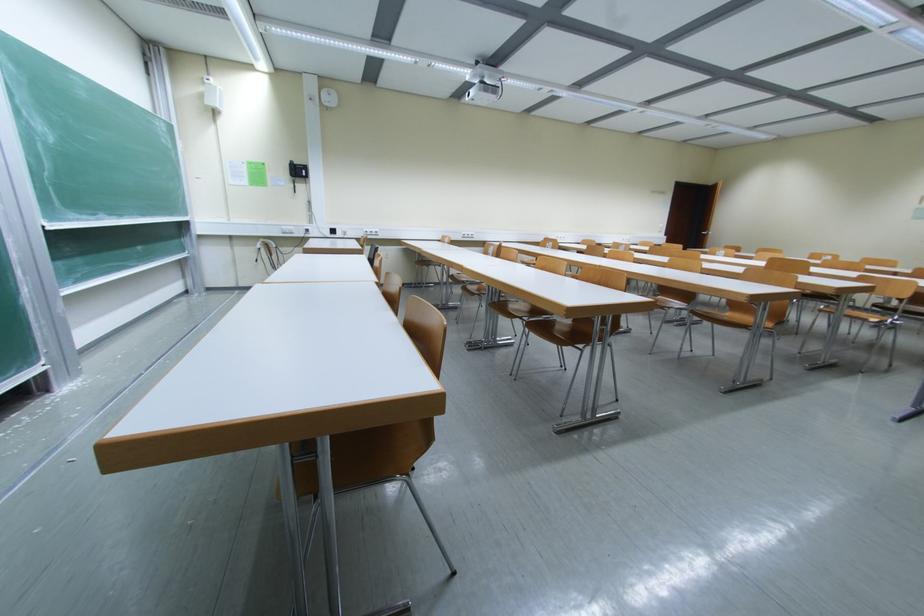
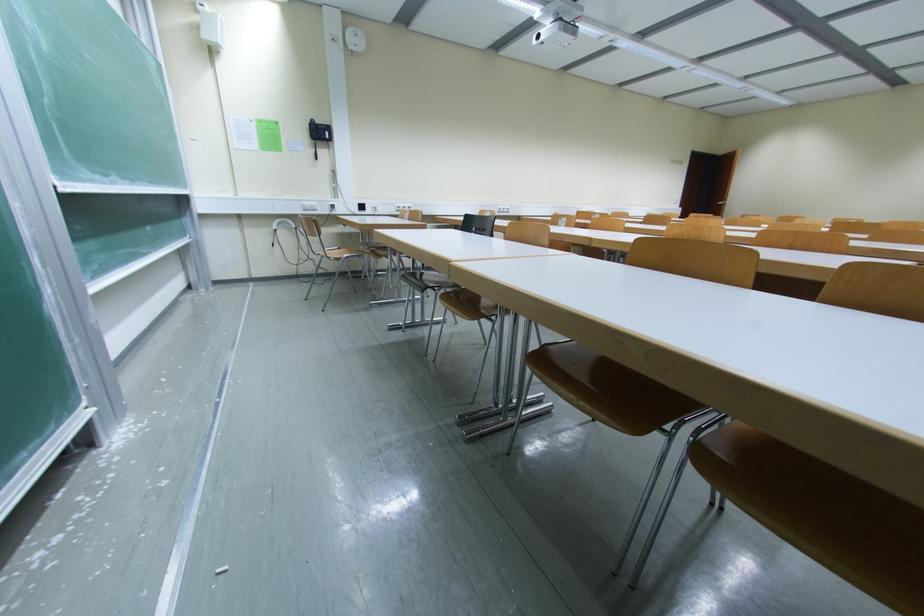
What movement of the cameraman would produce the second image?

The movement direction of the cameraman is left, forward.